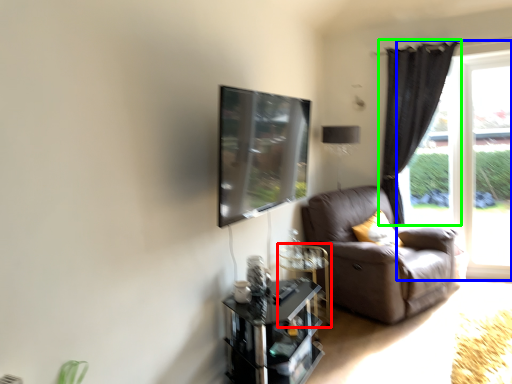
Question: Estimate the real-world distances between objects in this image. Which object is closer to glass table (highlighted by a red box), window (highlighted by a blue box) or curtain (highlighted by a green box)?

Choices:
 (A) window
 (B) curtain

Answer: (B)